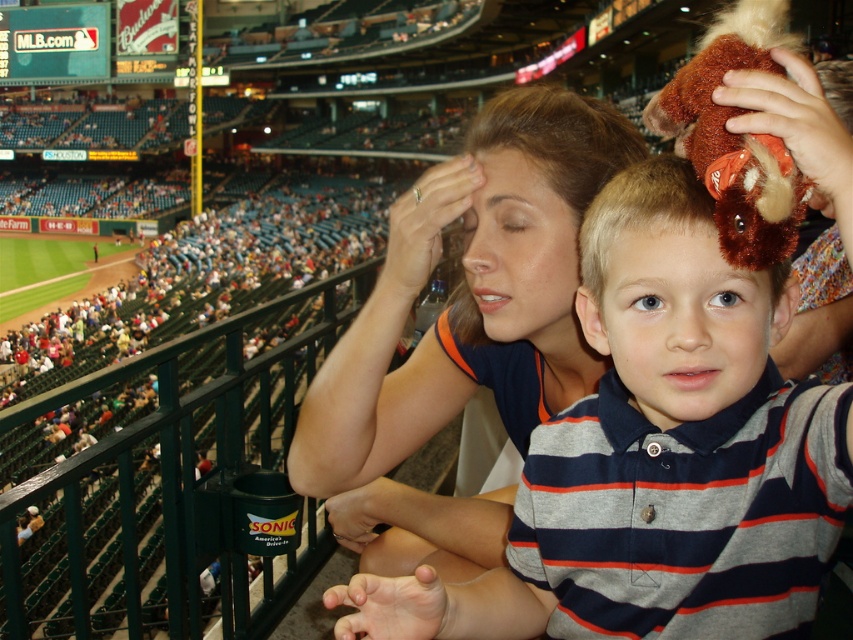
Question: Which point is closer to the camera?

Choices:
 (A) matte blue shirt at center
 (B) striped cotton shirt at center
 (C) brown plush toy at center

Answer: (B)

Question: Observing the image, what is the correct spatial positioning of matte blue shirt at center in reference to striped cotton shirt at center?

Choices:
 (A) below
 (B) above

Answer: (B)

Question: Among these points, which one is nearest to the camera?

Choices:
 (A) (712, 259)
 (B) (782, 289)

Answer: (B)

Question: Based on their relative distances, which object is nearer to the striped cotton shirt at center?

Choices:
 (A) matte blue shirt at center
 (B) brown plush toy at center

Answer: (B)

Question: Is the position of matte blue shirt at center more distant than that of striped cotton shirt at center?

Choices:
 (A) no
 (B) yes

Answer: (B)

Question: Can you confirm if matte blue shirt at center is bigger than striped cotton shirt at center?

Choices:
 (A) no
 (B) yes

Answer: (B)